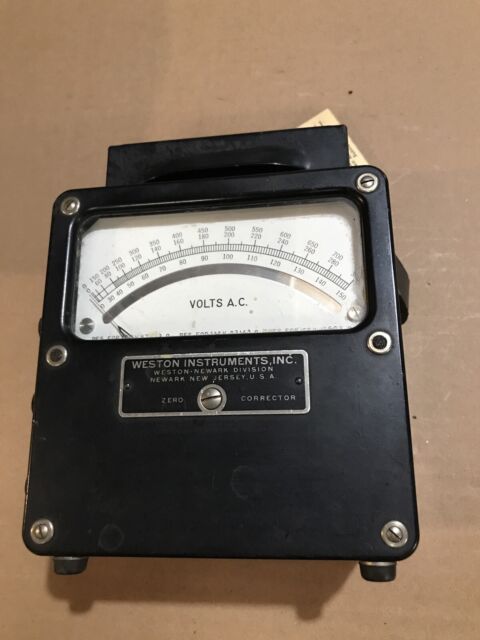
Find the location of `glass screen`. glass screen is located at coordinates (271, 305).